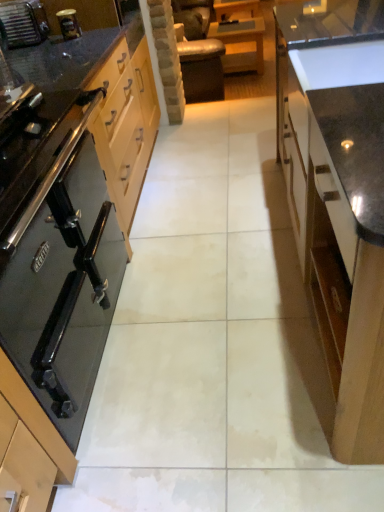
Question: From the image's perspective, is brushed metal toaster at upper left above or below glossy wood cabinet at right, which is the second cabinetry from left to right?

Choices:
 (A) below
 (B) above

Answer: (B)

Question: From a real-world perspective, relative to glossy wood cabinet at right, which is the second cabinetry from left to right, is brushed metal toaster at upper left vertically above or below?

Choices:
 (A) below
 (B) above

Answer: (B)

Question: Considering the real-world distances, which object is closest to the glossy wood cabinet at right, which is the second cabinetry from left to right?

Choices:
 (A) black glass stove at left, which is counted as the 2th cabinetry, starting from the right
 (B) wooden table at center
 (C) brushed metal toaster at upper left

Answer: (A)

Question: Which object is positioned farthest from the wooden table at center?

Choices:
 (A) brushed metal toaster at upper left
 (B) glossy wood cabinet at right, which ranks as the first cabinetry in right-to-left order
 (C) black glass stove at left, which is counted as the 2th cabinetry, starting from the right

Answer: (B)